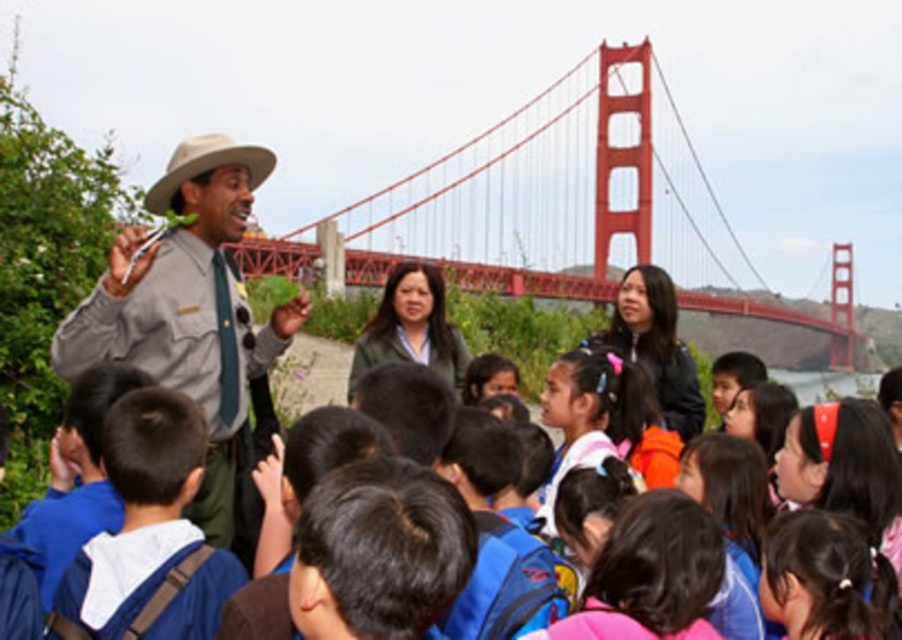
From the picture: Does red painted steel suspension bridge at upper center appear on the right side of gray uniform at center?

Indeed, red painted steel suspension bridge at upper center is positioned on the right side of gray uniform at center.

Who is positioned more to the left, red painted steel suspension bridge at upper center or gray uniform at center?

From the viewer's perspective, gray uniform at center appears more on the left side.

Where is `red painted steel suspension bridge at upper center`? red painted steel suspension bridge at upper center is located at coordinates (560, 209).

Is point (229, 339) behind point (72, 566)?

Yes, point (229, 339) is behind point (72, 566).

Is point (148, 304) farther from camera compared to point (169, 536)?

That is True.

Locate an element on the screen. The width and height of the screenshot is (902, 640). gray uniform at center is located at coordinates (190, 314).

Does red painted steel suspension bridge at upper center have a larger size compared to blue fabric backpack at center?

Yes.

Image resolution: width=902 pixels, height=640 pixels. Find the location of `red painted steel suspension bridge at upper center`. red painted steel suspension bridge at upper center is located at coordinates (560, 209).